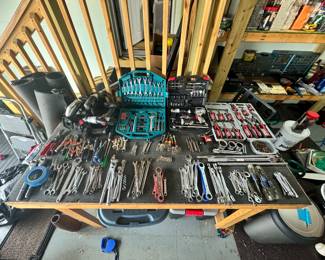
This screenshot has height=260, width=325. What are the coordinates of `storage bins` in the screenshot? It's located at (135, 210), (182, 208).